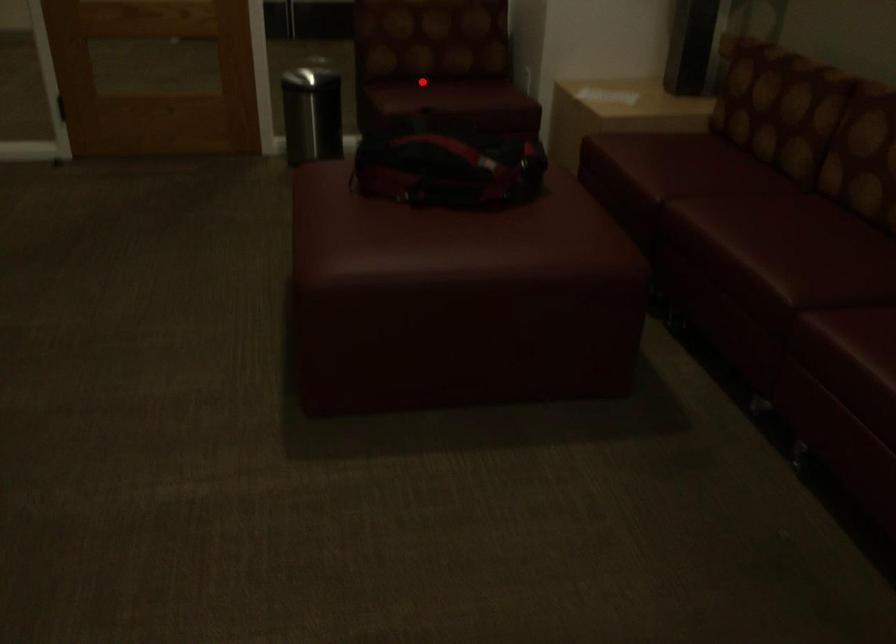
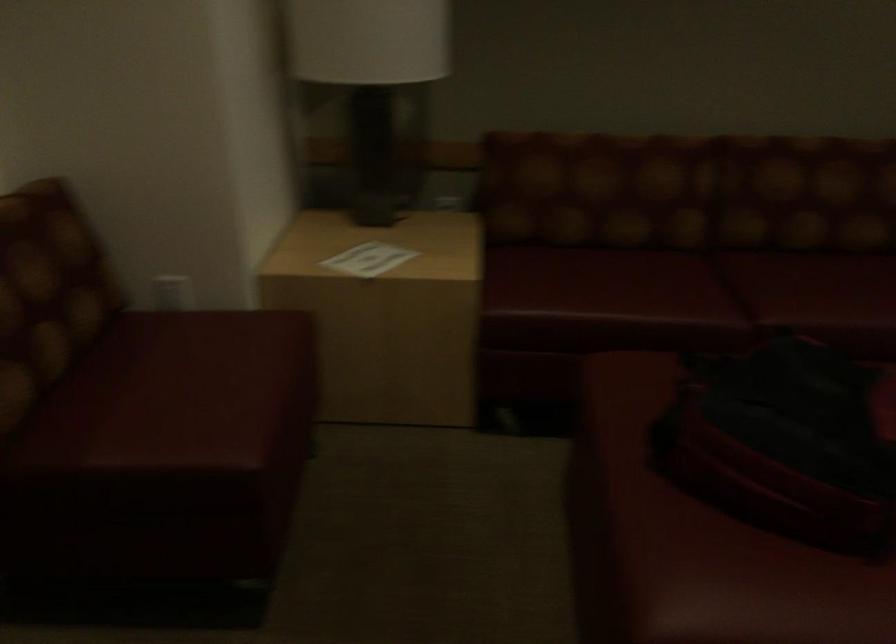
The point at the highlighted location is marked in the first image. Where is the corresponding point in the second image?

(175, 393)